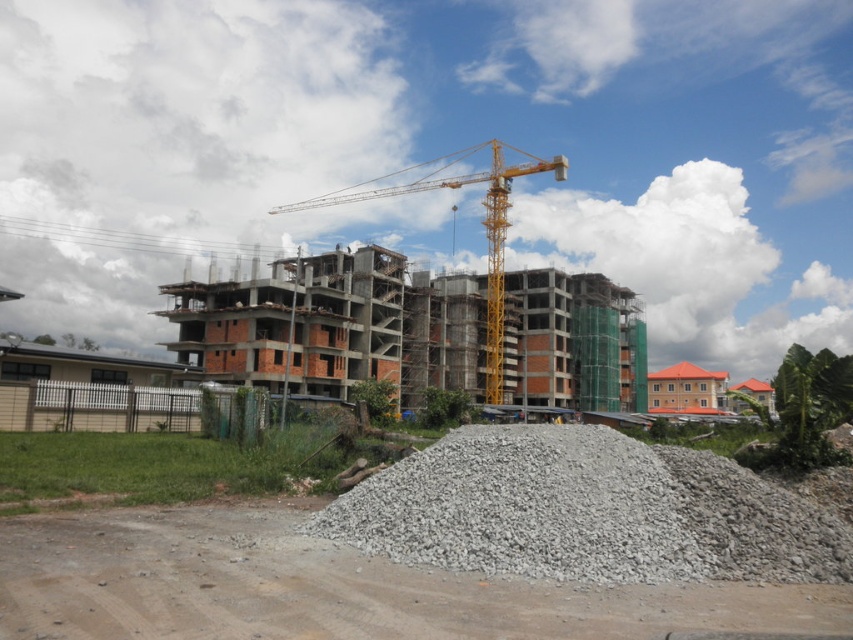
Question: Which object is closer to the camera taking this photo?

Choices:
 (A) yellow metallic crane at center
 (B) gray gravel at lower center
 (C) gray gravel pile at lower center
 (D) brick building at center

Answer: (C)

Question: Does gray gravel at lower center have a larger size compared to yellow metallic crane at center?

Choices:
 (A) no
 (B) yes

Answer: (A)

Question: Observing the image, what is the correct spatial positioning of gray gravel pile at lower center in reference to brick building at center?

Choices:
 (A) below
 (B) above

Answer: (A)

Question: Which of the following is the closest to the observer?

Choices:
 (A) brick building at center
 (B) gray gravel at lower center

Answer: (B)

Question: Does gray gravel at lower center appear on the left side of brick building at center?

Choices:
 (A) no
 (B) yes

Answer: (B)

Question: Estimate the real-world distances between objects in this image. Which object is closer to the gray gravel pile at lower center?

Choices:
 (A) gray gravel at lower center
 (B) brick building at center
 (C) yellow metallic crane at center

Answer: (A)